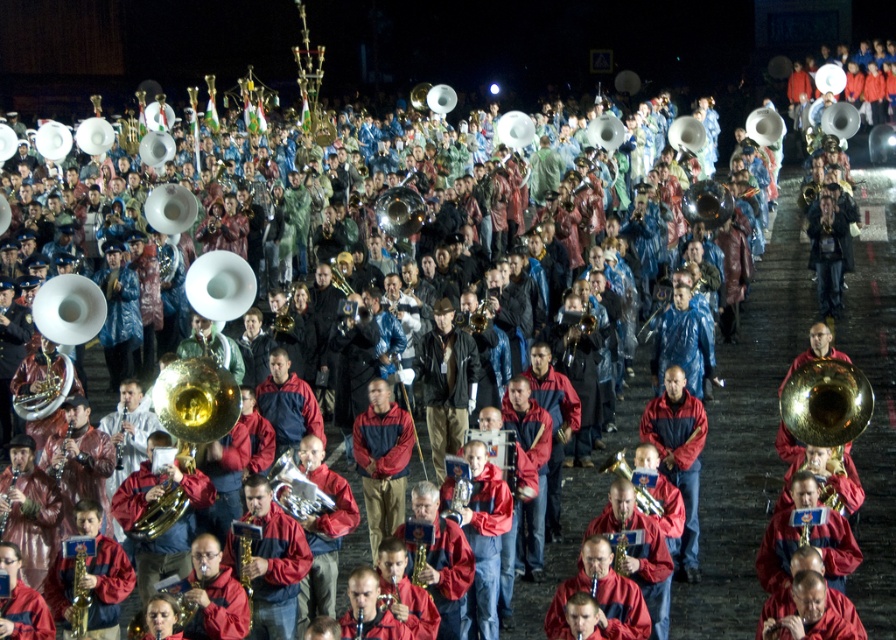
Question: Which point appears closest to the camera in this image?

Choices:
 (A) click(x=75, y=579)
 (B) click(x=297, y=500)
 (C) click(x=1, y=525)

Answer: (A)

Question: Observing the image, what is the correct spatial positioning of brass shiny trumpet at center in reference to gold brass saxophone at lower left?

Choices:
 (A) right
 (B) left

Answer: (A)

Question: Is brass shiny trumpet at center to the left of gold brass saxophone at center from the viewer's perspective?

Choices:
 (A) no
 (B) yes

Answer: (A)

Question: Among these points, which one is farthest from the camera?

Choices:
 (A) (73, 634)
 (B) (7, 488)
 (C) (116, 467)
 (D) (268, 481)

Answer: (C)

Question: Does brass shiny trumpet at center appear under gold brass tuba at center?

Choices:
 (A) yes
 (B) no

Answer: (A)

Question: Which point is closer to the camera?

Choices:
 (A) (76, 540)
 (B) (15, 476)
 (C) (272, 486)
 (D) (116, 449)

Answer: (A)